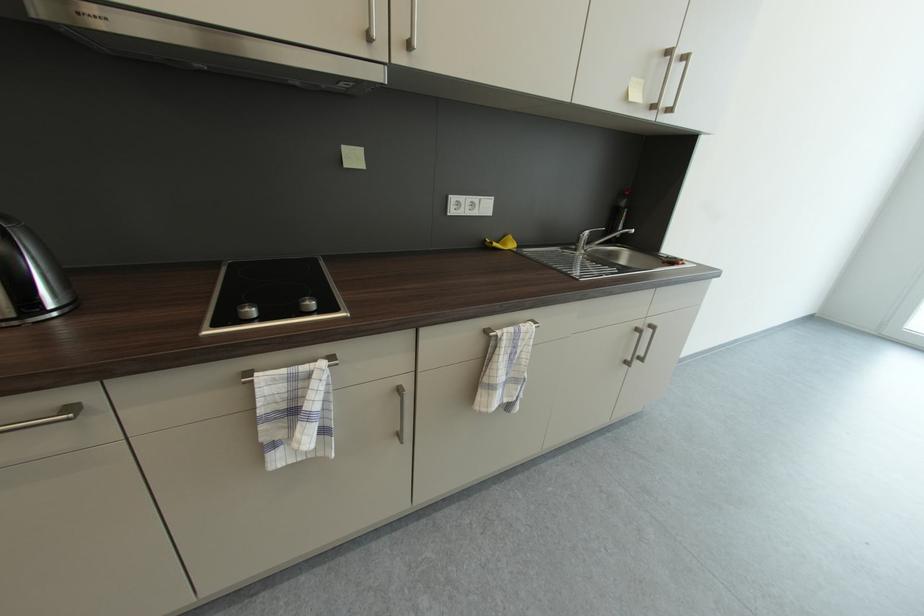
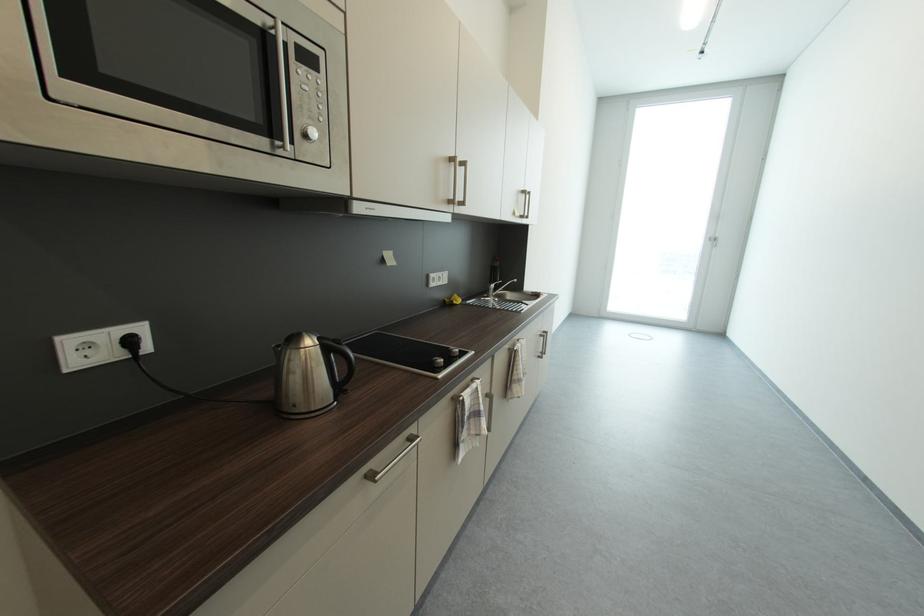
The point at [503,338] is marked in the first image. Where is the corresponding point in the second image?

(523, 351)